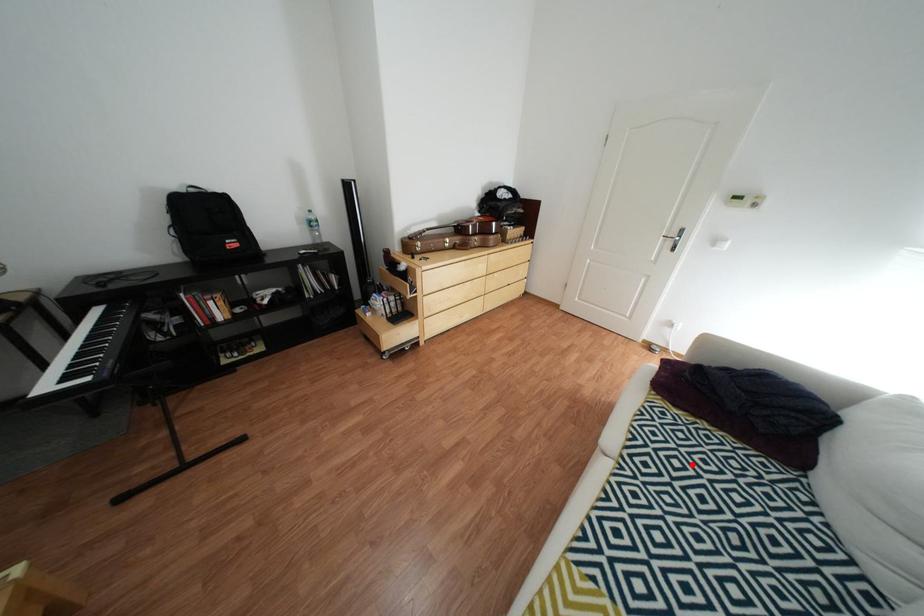
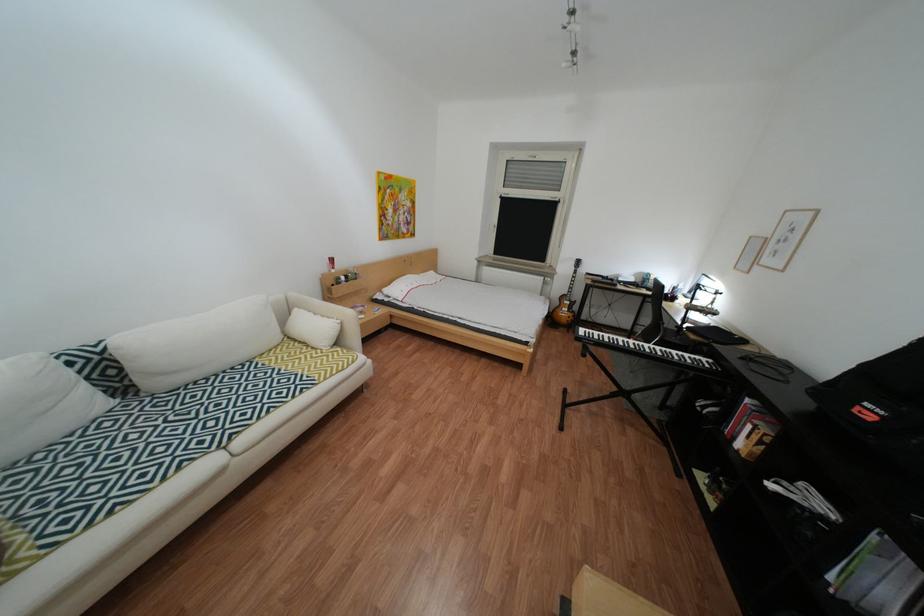
Locate, in the second image, the point that corresponds to the highlighted location in the first image.

(176, 450)